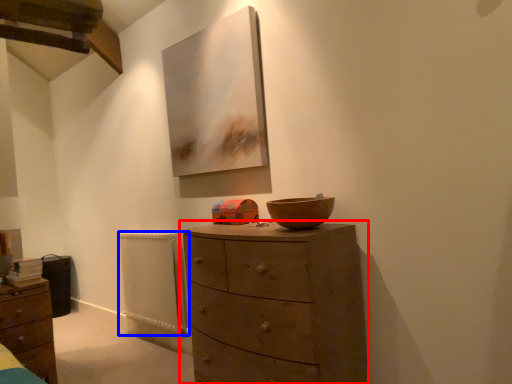
Question: Which object appears closest to the camera in this image, chest of drawers (highlighted by a red box) or radiator (highlighted by a blue box)?

Choices:
 (A) chest of drawers
 (B) radiator

Answer: (A)